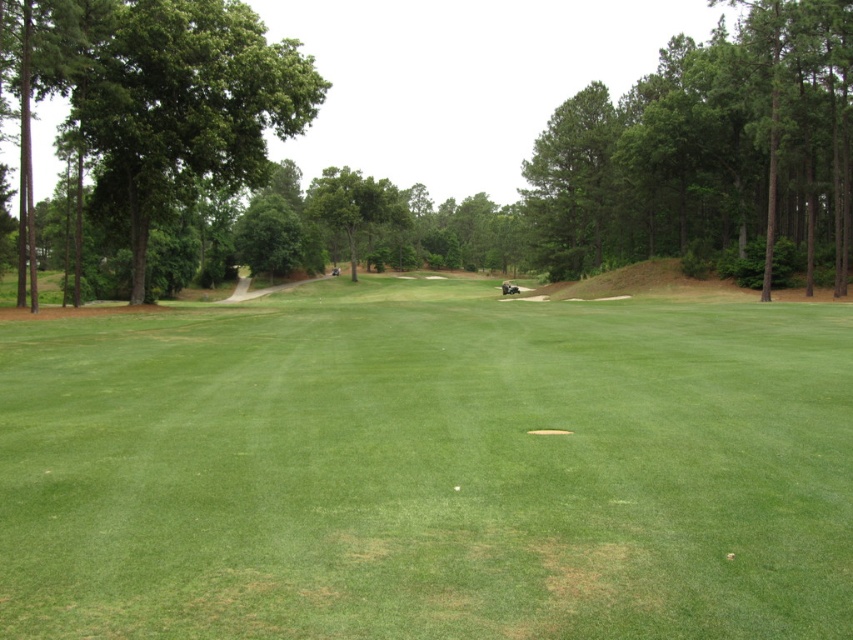
Question: Can you confirm if green grassy field at center is positioned below green leafy tree at left?

Choices:
 (A) no
 (B) yes

Answer: (B)

Question: Is the position of green grassy field at center more distant than that of green leafy tree at center?

Choices:
 (A) no
 (B) yes

Answer: (A)

Question: Among these points, which one is nearest to the camera?

Choices:
 (A) (195, 68)
 (B) (509, 509)
 (C) (572, 200)

Answer: (B)

Question: Which object is farther from the camera taking this photo?

Choices:
 (A) green grassy field at center
 (B) green leafy tree at right
 (C) green leafy tree at left
 (D) green leafy tree at center

Answer: (B)

Question: Which point is closer to the camera?

Choices:
 (A) (97, 513)
 (B) (164, 120)
 (C) (19, 189)

Answer: (A)

Question: Does green grassy field at center have a lesser width compared to green leafy tree at right?

Choices:
 (A) yes
 (B) no

Answer: (A)